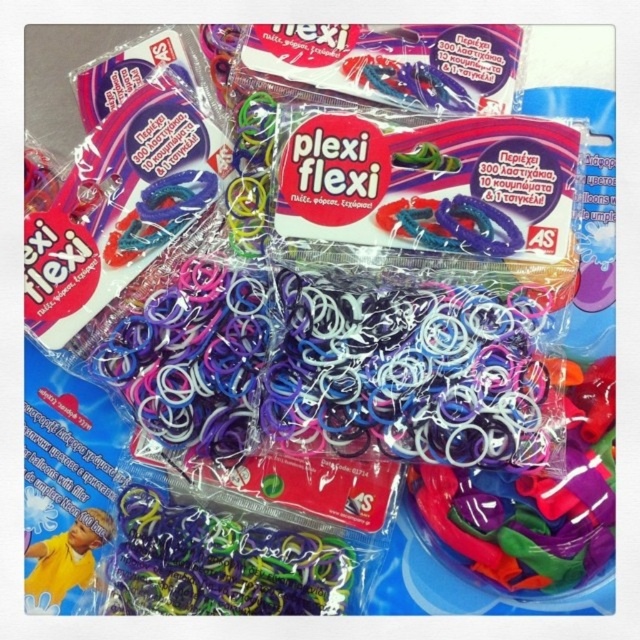
Question: Is multicolored rubber bands at center wider than matte yellow toy at lower left?

Choices:
 (A) no
 (B) yes

Answer: (B)

Question: Does translucent rubber bands at center have a larger size compared to multicolored rubber bands at center?

Choices:
 (A) no
 (B) yes

Answer: (B)

Question: Which point is closer to the camera?

Choices:
 (A) (602, 376)
 (B) (90, 540)

Answer: (A)

Question: Which object is positioned farthest from the multicolored rubber bands at center?

Choices:
 (A) translucent rubber bands at center
 (B) matte yellow toy at lower left

Answer: (A)

Question: Which point is closer to the camera?

Choices:
 (A) (42, 595)
 (B) (563, 497)

Answer: (A)

Question: Is translucent rubber bands at center to the left of matte yellow toy at lower left from the viewer's perspective?

Choices:
 (A) no
 (B) yes

Answer: (A)